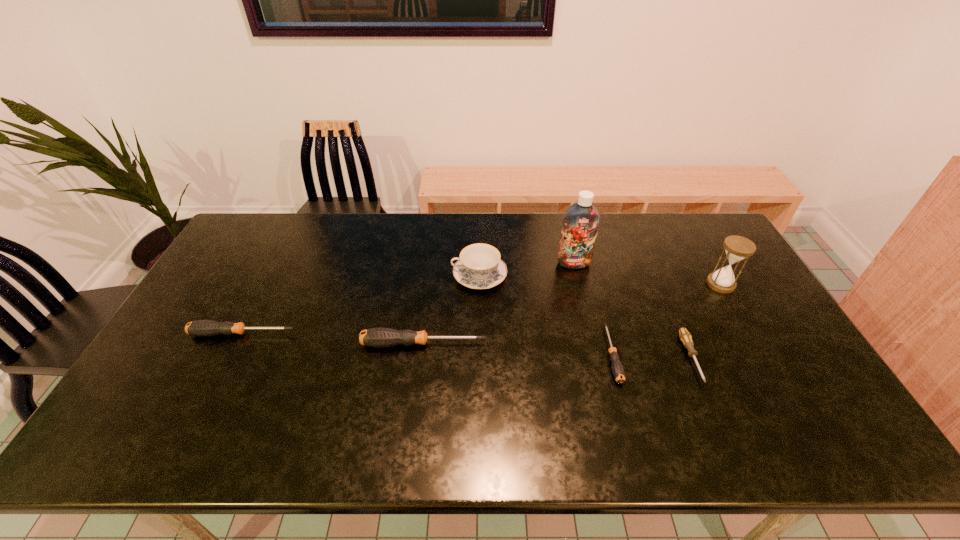
Image resolution: width=960 pixels, height=540 pixels. In order to click on unoccupied area between the third screwdriver from right to left and the second tallest screwdriver in this screenshot , I will do `click(332, 339)`.

Identify the location of free space between the third screwdriver from left to right and the hourglass. (666, 319).

Where is `vacant space in between the second tallest object and the chinaware`? The image size is (960, 540). vacant space in between the second tallest object and the chinaware is located at coordinates (600, 280).

You are a GUI agent. You are given a task and a screenshot of the screen. Output one action in this format:
    pyautogui.click(x=<x>, y=<y>)
    Task: Click on the vacant space in between the second tallest screwdriver and the shampoo
    
    Given the screenshot: What is the action you would take?
    pyautogui.click(x=408, y=299)

Select which object appears as the second closest to the third shortest screwdriver. Please provide its 2D coordinates. Your answer should be formatted as a tuple, i.e. [(x, y)], where the tuple contains the x and y coordinates of a point satisfying the conditions above.

[(479, 267)]

Locate an element on the screen. Image resolution: width=960 pixels, height=540 pixels. object that is the sixth closest to the third screwdriver from left to right is located at coordinates (203, 328).

At what (x,y) coordinates should I click in order to perform the action: click on the second closest screwdriver to the tallest object. Please return your answer as a coordinate pair (x, y). The width and height of the screenshot is (960, 540). Looking at the image, I should click on (685, 336).

Where is `screwdriver that is the second closest one to the shampoo`? screwdriver that is the second closest one to the shampoo is located at coordinates (685, 336).

This screenshot has width=960, height=540. What are the coordinates of `free location that satisfies the following two spatial constraints: 1. on the back side of the third screwdriver from left to right; 2. on the right side of the rightmost object` in the screenshot? It's located at [592, 284].

What are the coordinates of `vacant space that satisfies the following two spatial constraints: 1. on the back side of the rightmost object; 2. on the left side of the second screwdriver from right to left` in the screenshot? It's located at (592, 284).